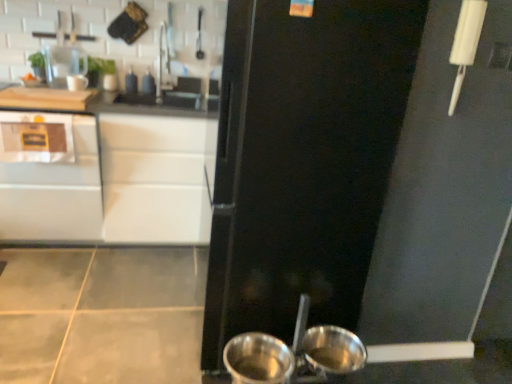
Question: From a real-world perspective, is satin white cabinet at left over black matte refrigerator at center?

Choices:
 (A) yes
 (B) no

Answer: (B)

Question: Can you confirm if satin white cabinet at left is thinner than black matte refrigerator at center?

Choices:
 (A) yes
 (B) no

Answer: (B)

Question: From the image's perspective, is satin white cabinet at left over black matte refrigerator at center?

Choices:
 (A) yes
 (B) no

Answer: (A)

Question: Is satin white cabinet at left bigger than black matte refrigerator at center?

Choices:
 (A) yes
 (B) no

Answer: (B)

Question: From the image's perspective, is satin white cabinet at left located beneath black matte refrigerator at center?

Choices:
 (A) no
 (B) yes

Answer: (A)

Question: Considering the relative sizes of satin white cabinet at left and black matte refrigerator at center in the image provided, is satin white cabinet at left shorter than black matte refrigerator at center?

Choices:
 (A) yes
 (B) no

Answer: (A)

Question: Can you confirm if white glossy cabinet at upper left is bigger than metallic silver basin at lower center?

Choices:
 (A) no
 (B) yes

Answer: (B)

Question: Is white glossy cabinet at upper left thinner than metallic silver basin at lower center?

Choices:
 (A) no
 (B) yes

Answer: (A)

Question: Could you tell me if white glossy cabinet at upper left is facing metallic silver basin at lower center?

Choices:
 (A) yes
 (B) no

Answer: (A)

Question: Considering the relative sizes of white glossy cabinet at upper left and metallic silver basin at lower center in the image provided, is white glossy cabinet at upper left taller than metallic silver basin at lower center?

Choices:
 (A) yes
 (B) no

Answer: (A)

Question: From the image's perspective, is white glossy cabinet at upper left below metallic silver basin at lower center?

Choices:
 (A) yes
 (B) no

Answer: (B)

Question: Considering the relative sizes of white glossy cabinet at upper left and metallic silver basin at lower center in the image provided, is white glossy cabinet at upper left smaller than metallic silver basin at lower center?

Choices:
 (A) no
 (B) yes

Answer: (A)

Question: Considering the relative positions of shiny metallic pot at lower center and satin white cabinet at left in the image provided, is shiny metallic pot at lower center to the left of satin white cabinet at left from the viewer's perspective?

Choices:
 (A) yes
 (B) no

Answer: (B)